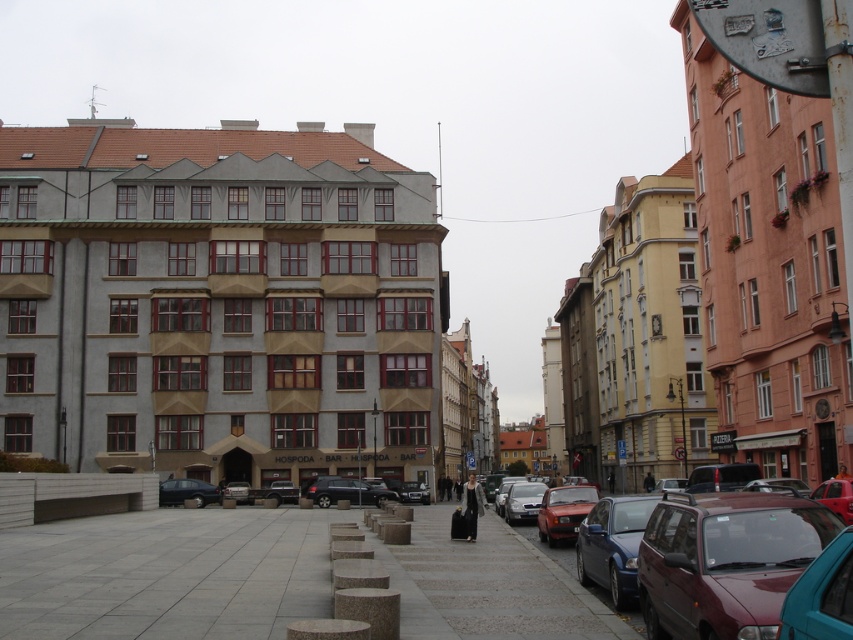
Who is positioned more to the right, gray concrete pavement at lower center or maroon metallic car at right?

From the viewer's perspective, maroon metallic car at right appears more on the right side.

Which is in front, point (119, 595) or point (722, 557)?

Point (722, 557)

Where is `gray concrete pavement at lower center`? This screenshot has height=640, width=853. gray concrete pavement at lower center is located at coordinates (167, 573).

Is metallic silver suv at center below matte black car at lower left?

Yes, metallic silver suv at center is below matte black car at lower left.

Is metallic silver suv at center further to the viewer compared to matte black car at lower left?

Yes, it is.

Which is behind, point (334, 477) or point (190, 490)?

Positioned behind is point (334, 477).

Where is `metallic silver suv at center`? metallic silver suv at center is located at coordinates (346, 492).

Can you confirm if gray concrete pavement at lower center is wider than matte black car at lower left?

Indeed, gray concrete pavement at lower center has a greater width compared to matte black car at lower left.

Is gray concrete pavement at lower center thinner than matte black car at lower left?

No.

Find the location of `gray concrete pavement at lower center`. gray concrete pavement at lower center is located at coordinates (167, 573).